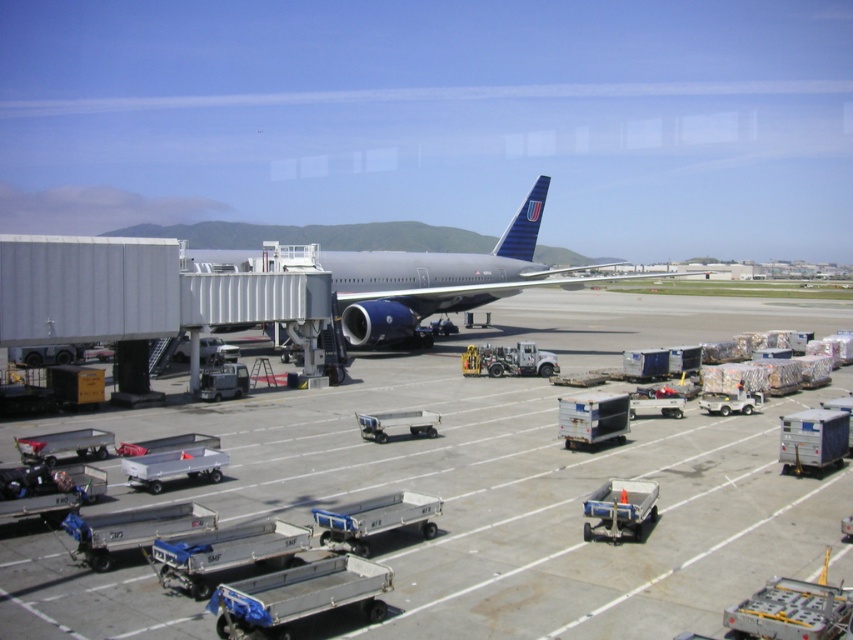
Can you confirm if metallic gray tarmac at center is smaller than metallic gray airplane at center?

Indeed, metallic gray tarmac at center has a smaller size compared to metallic gray airplane at center.

Is metallic gray tarmac at center to the right of metallic gray airplane at center from the viewer's perspective?

Indeed, metallic gray tarmac at center is positioned on the right side of metallic gray airplane at center.

Image resolution: width=853 pixels, height=640 pixels. I want to click on metallic gray tarmac at center, so click(531, 476).

Where is `metallic gray tarmac at center`? This screenshot has width=853, height=640. metallic gray tarmac at center is located at coordinates (531, 476).